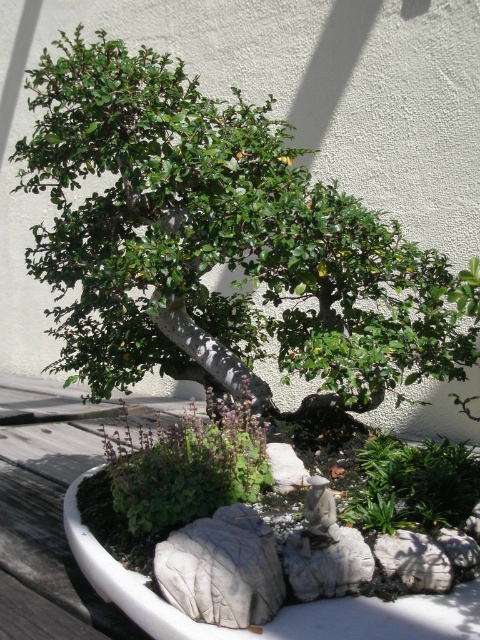
You are a gardener looking at the bonsai garden scene. You see the green leafy bonsai at center and the green leafy plant at center. Which one is closer to you?

The green leafy bonsai at center is closer to the viewer than the green leafy plant at center.

You are a gardener inspecting the bonsai garden scene. You notice the green leafy bonsai at center and the green leafy plant at center. Which one is positioned higher in the scene?

The green leafy bonsai at center is positioned higher than the green leafy plant at center.